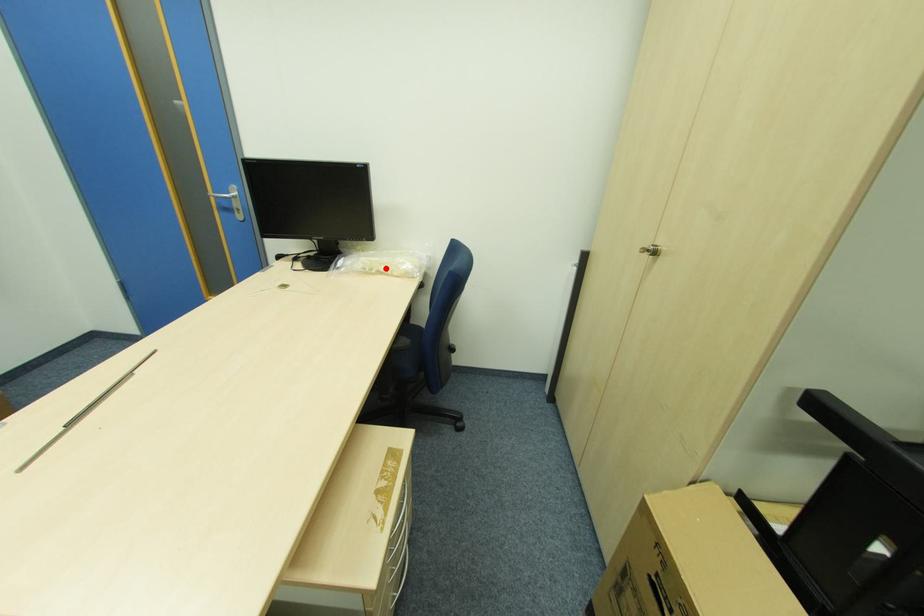
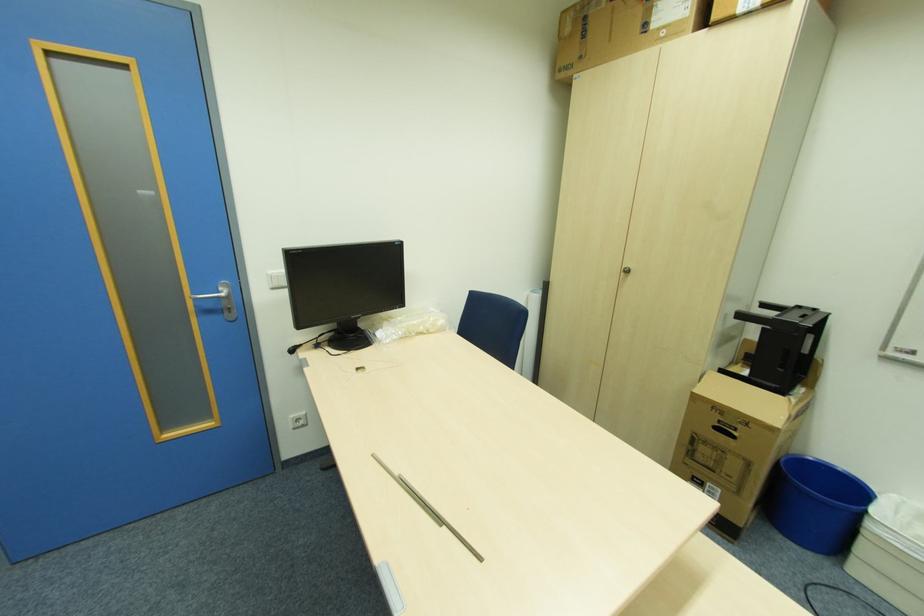
Find the pixel in the second image that matches the highlighted location in the first image.

(424, 329)